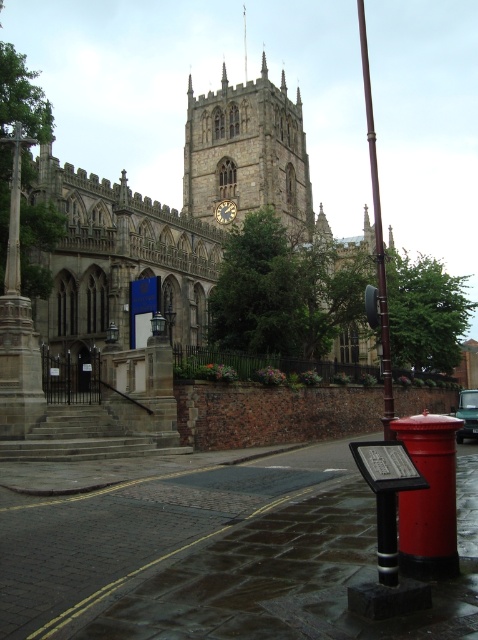
You are standing on the sidewalk in front of the church and want to take a photo of both the stone gothic church at center and the green matte car at center. Which object should you focus on first to ensure both are in the frame?

The stone gothic church at center is above the green matte car at center, so you should focus on the green matte car at center first to ensure both are in the frame.

What are the coordinates of the stone gothic church at center?

The stone gothic church at center is located at point (169, 240).

You are standing in front of the historic stone church and want to take a photo of the stone clock tower at center and the smooth brown pole at right. Which object should you focus on first if you want to capture both in a single frame without moving the camera?

The stone clock tower at center is positioned over the smooth brown pole at right, so you should focus on the stone clock tower at center first to ensure both are in the frame.